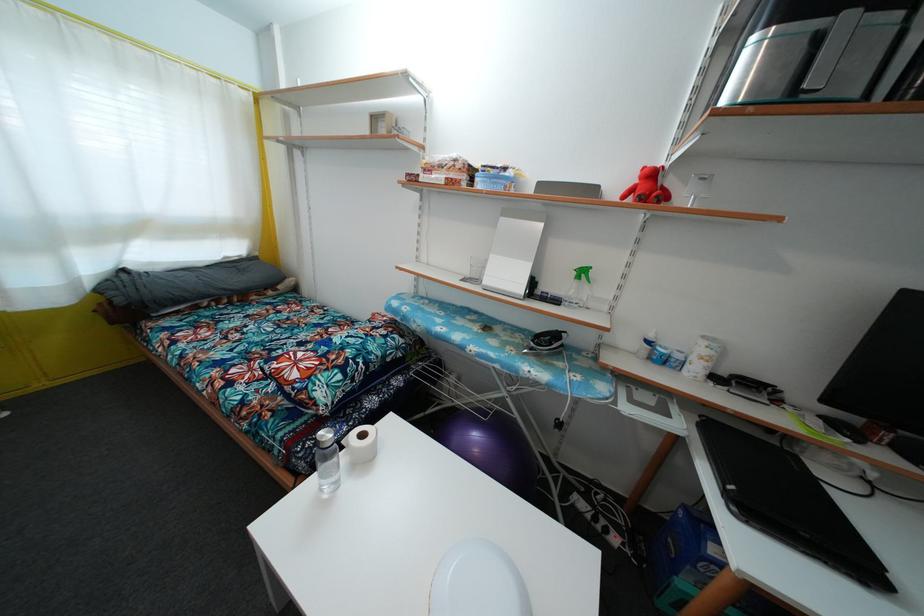
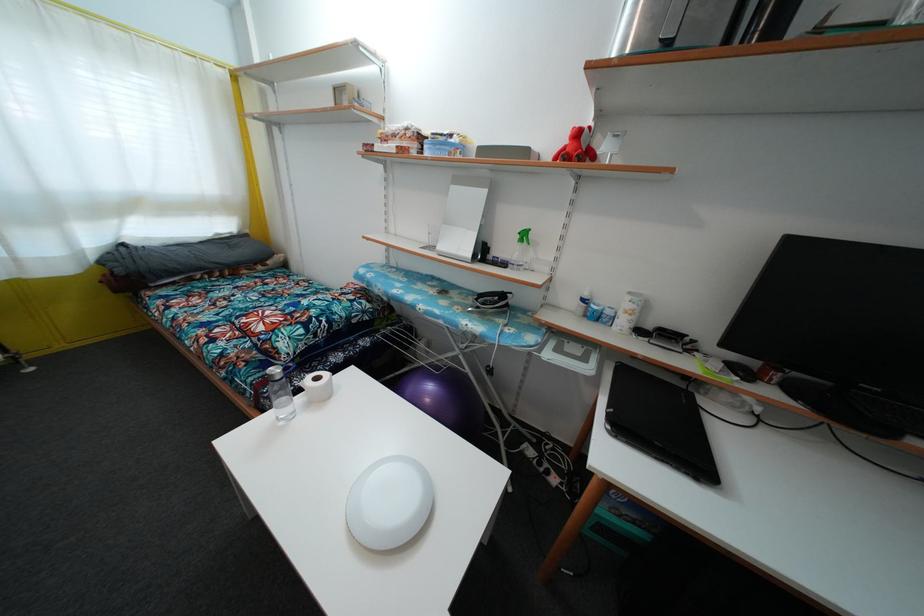
Locate, in the second image, the point that corresponds to (x=586, y=280) in the first image.

(528, 241)